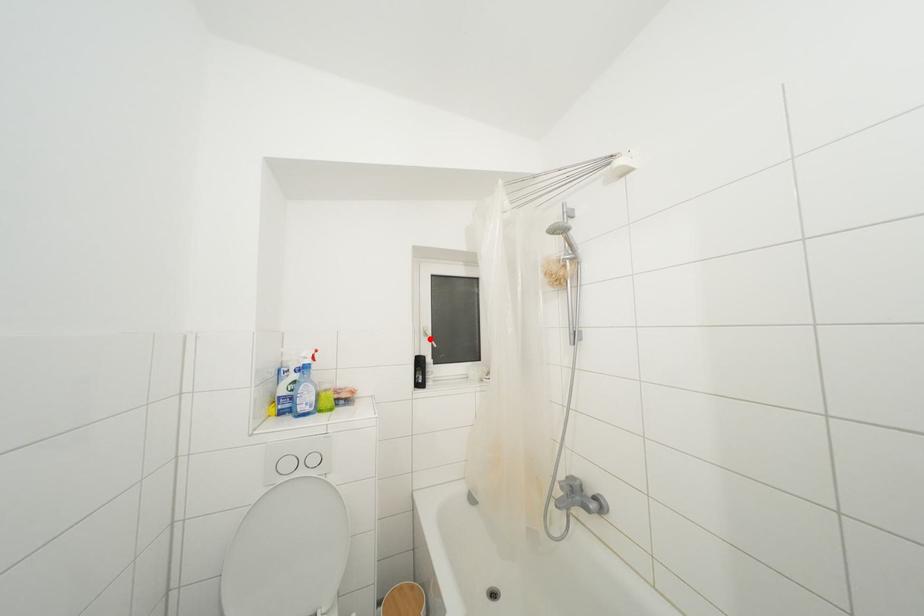
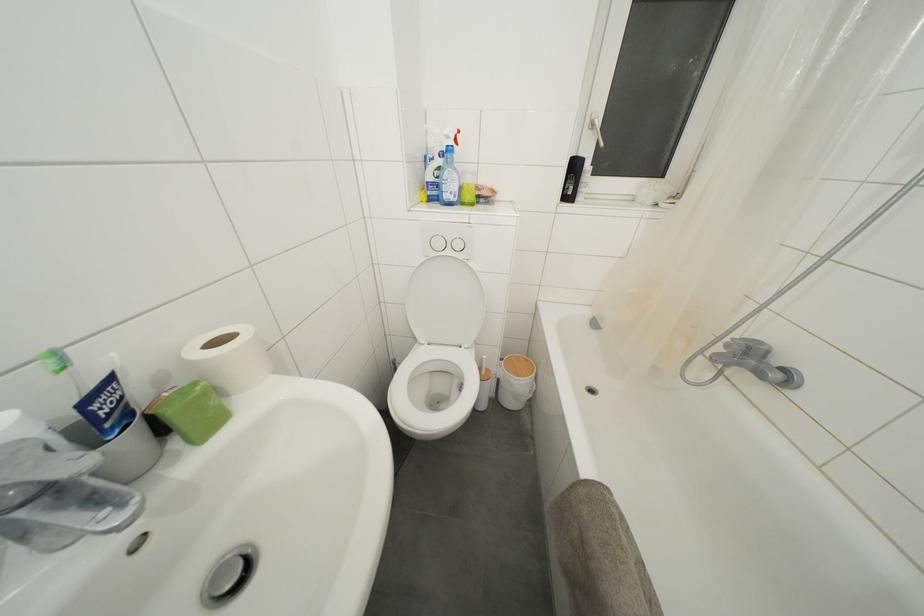
Find the pixel in the second image that matches the highlighted location in the first image.

(597, 131)